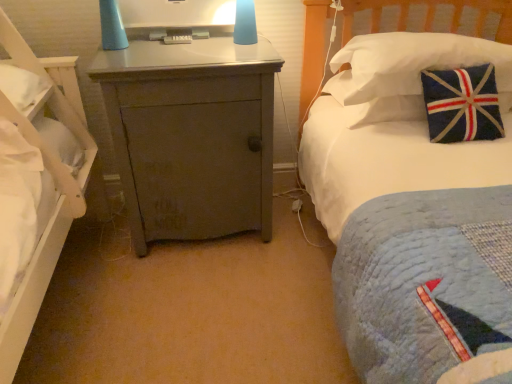
Question: Can you confirm if matte gray cabinet at center is shorter than white fabric pillow at upper right?

Choices:
 (A) yes
 (B) no

Answer: (B)

Question: Considering the relative sizes of matte gray cabinet at center and white fabric pillow at upper right in the image provided, is matte gray cabinet at center smaller than white fabric pillow at upper right?

Choices:
 (A) no
 (B) yes

Answer: (A)

Question: Does matte gray cabinet at center lie in front of white fabric pillow at upper right?

Choices:
 (A) no
 (B) yes

Answer: (B)

Question: Is matte gray cabinet at center facing away from white fabric pillow at upper right?

Choices:
 (A) no
 (B) yes

Answer: (A)

Question: Can you confirm if matte gray cabinet at center is positioned to the left of white fabric pillow at upper right?

Choices:
 (A) no
 (B) yes

Answer: (B)

Question: From a real-world perspective, is matte gray cabinet at center under white fabric pillow at upper right?

Choices:
 (A) no
 (B) yes

Answer: (B)

Question: Is matte gray cabinet at center a part of white fabric pillow at upper right?

Choices:
 (A) no
 (B) yes

Answer: (A)

Question: From the image's perspective, would you say white fabric pillow at upper right is positioned over matte gray cabinet at center?

Choices:
 (A) no
 (B) yes

Answer: (B)

Question: From a real-world perspective, is white fabric pillow at upper right physically below matte gray cabinet at center?

Choices:
 (A) no
 (B) yes

Answer: (A)

Question: Is white fabric pillow at upper right in contact with matte gray cabinet at center?

Choices:
 (A) no
 (B) yes

Answer: (A)

Question: Is white fabric pillow at upper right smaller than matte gray cabinet at center?

Choices:
 (A) no
 (B) yes

Answer: (B)

Question: Considering the relative sizes of white fabric pillow at upper right and matte gray cabinet at center in the image provided, is white fabric pillow at upper right thinner than matte gray cabinet at center?

Choices:
 (A) yes
 (B) no

Answer: (A)

Question: Can you see matte gray cabinet at center touching matte plastic monitor at center?

Choices:
 (A) yes
 (B) no

Answer: (B)